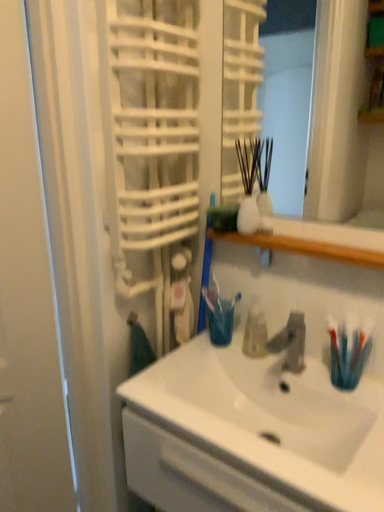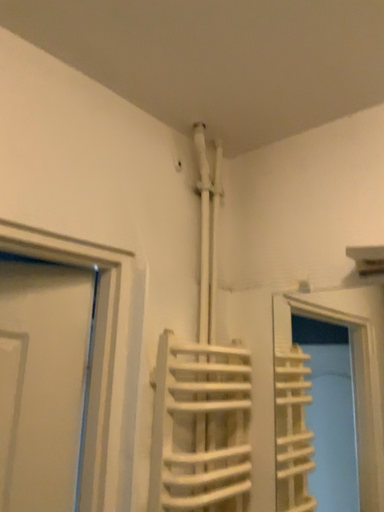
Question: Which way did the camera rotate in the video?

Choices:
 (A) rotated downward
 (B) rotated upward

Answer: (B)